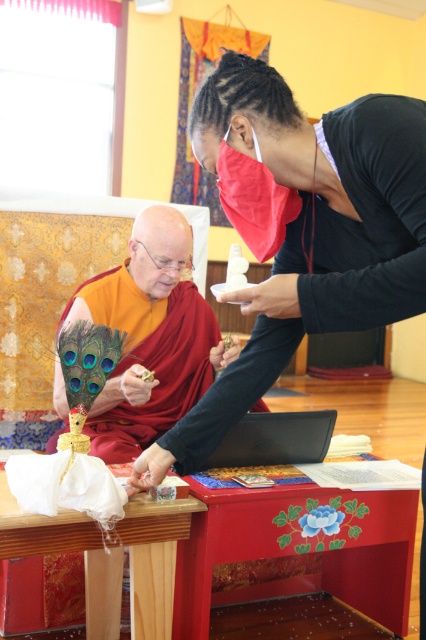
Between point (367, 140) and point (175, 288), which one is positioned in front?

Positioned in front is point (367, 140).

Between point (373, 179) and point (137, 449), which one is positioned in front?

Positioned in front is point (373, 179).

The width and height of the screenshot is (426, 640). Find the location of `orange silk robe at center`. orange silk robe at center is located at coordinates (333, 260).